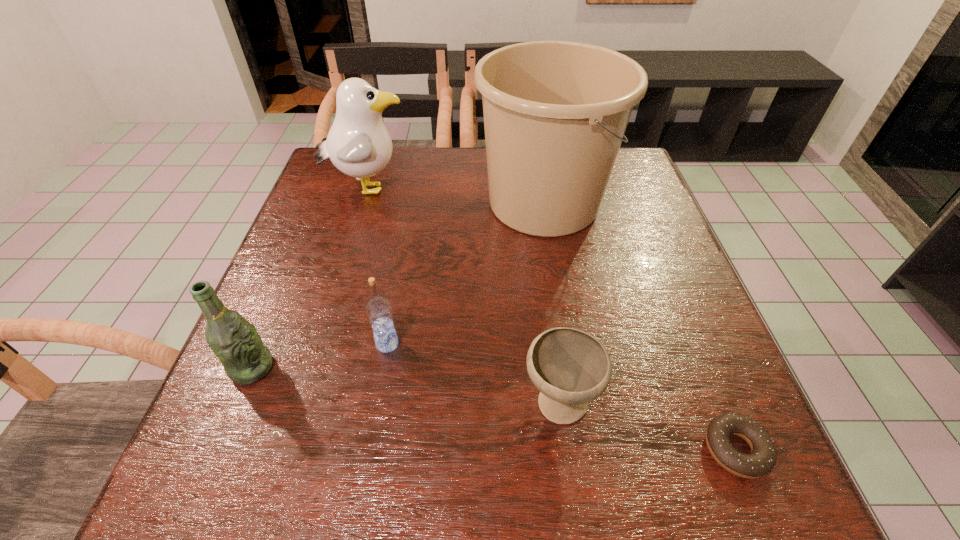
You are a GUI agent. You are given a task and a screenshot of the screen. Output one action in this format:
    pyautogui.click(x=<x>, y=<y>)
    Task: Click on the bucket
    
    Given the screenshot: What is the action you would take?
    pyautogui.click(x=555, y=113)

Find the location of a particular element. The height and width of the screenshot is (540, 960). gull is located at coordinates (x=358, y=144).

Locate an element on the screen. The height and width of the screenshot is (540, 960). the fourth shortest object is located at coordinates (235, 341).

Identify the location of vodka. (378, 309).

At what (x,y) coordinates should I click in order to perform the action: click on the second shortest object. Please return your answer as a coordinate pair (x, y). This screenshot has width=960, height=540. Looking at the image, I should click on (570, 367).

You are a GUI agent. You are given a task and a screenshot of the screen. Output one action in this format:
    pyautogui.click(x=<x>, y=<y>)
    Task: Click on the shortest object
    The height and width of the screenshot is (540, 960).
    Given the screenshot: What is the action you would take?
    pyautogui.click(x=762, y=459)

You are a GUI agent. You are given a task and a screenshot of the screen. Output one action in this format:
    pyautogui.click(x=<x>, y=<y>)
    Task: Click on the doughnut
    This screenshot has width=960, height=540.
    Given the screenshot: What is the action you would take?
    pyautogui.click(x=762, y=459)

You are a GUI agent. You are given a task and a screenshot of the screen. Output one action in this format:
    pyautogui.click(x=<x>, y=<y>)
    Task: Click on the vacant space located on the left of the bucket
    The image size is (960, 540).
    Given the screenshot: What is the action you would take?
    pyautogui.click(x=444, y=202)

The width and height of the screenshot is (960, 540). I want to click on vacant point located on the beak of the second tallest object, so click(429, 188).

Where is `vacant area located 0.200m on the surface of the third tallest object`? vacant area located 0.200m on the surface of the third tallest object is located at coordinates (383, 368).